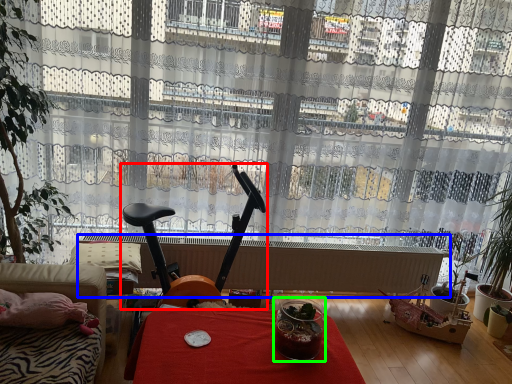
Question: Estimate the real-world distances between objects in this image. Which object is farther from swivel chair (highlighted by a red box), radiator (highlighted by a blue box) or glass jar (highlighted by a green box)?

Choices:
 (A) radiator
 (B) glass jar

Answer: (B)